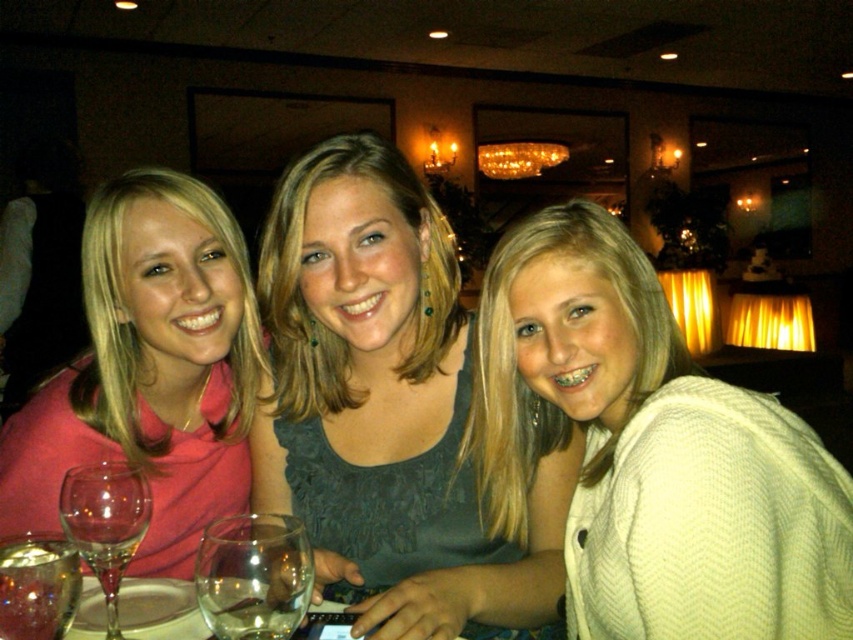
Between point (61, 547) and point (218, 586), which one is positioned behind?

Positioned behind is point (61, 547).

Is the position of transparent glass at lower left more distant than that of transparent glass wine at lower center?

Yes, it is.

Is point (64, 563) positioned after point (206, 604)?

Yes, point (64, 563) is farther from viewer.

Find the location of a particular element. Image resolution: width=853 pixels, height=640 pixels. transparent glass at lower left is located at coordinates (38, 586).

Can you confirm if transparent glass at lower left is shorter than clear glass wine at lower left?

Correct, transparent glass at lower left is not as tall as clear glass wine at lower left.

Looking at this image, does transparent glass at lower left appear over clear glass wine at lower left?

Actually, transparent glass at lower left is below clear glass wine at lower left.

This screenshot has height=640, width=853. I want to click on transparent glass at lower left, so click(38, 586).

Who is shorter, white knitted sweater at center or matte pink shirt at left?

Standing shorter between the two is white knitted sweater at center.

Is white knitted sweater at center above matte pink shirt at left?

Actually, white knitted sweater at center is below matte pink shirt at left.

Where is `white knitted sweater at center`? white knitted sweater at center is located at coordinates (x=651, y=451).